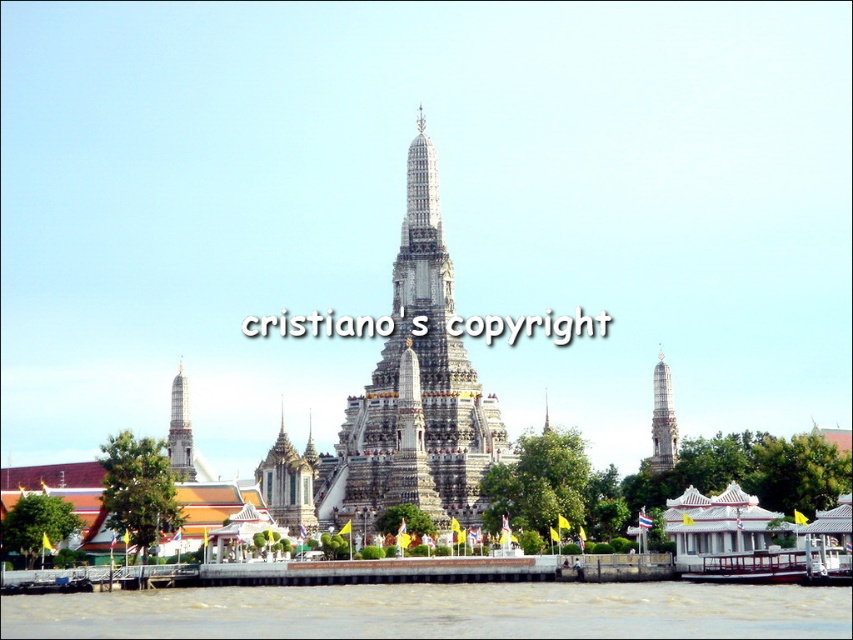
Between white stone temple at center and white stone tower at right, which one appears on the left side from the viewer's perspective?

white stone temple at center

Between point (430, 380) and point (662, 380), which one is positioned in front?

Point (430, 380) is in front.

You are a GUI agent. You are given a task and a screenshot of the screen. Output one action in this format:
    pyautogui.click(x=<x>, y=<y>)
    Task: Click on the white stone temple at center
    This screenshot has width=853, height=640.
    Given the screenshot: What is the action you would take?
    pyautogui.click(x=415, y=388)

Does white stone tower at right come behind white marble tower at left?

That is True.

Where is `white stone tower at right`? The image size is (853, 640). white stone tower at right is located at coordinates (662, 419).

Is silver metallic spire at lower left positioned at the back of white stone tower at right?

No, it is in front of white stone tower at right.

Is silver metallic spire at lower left in front of white stone tower at right?

That is True.

Is point (288, 492) farther from viewer compared to point (657, 412)?

No, it is in front of (657, 412).

You are a GUI agent. You are given a task and a screenshot of the screen. Output one action in this format:
    pyautogui.click(x=<x>, y=<y>)
    Task: Click on the silver metallic spire at lower left
    The height and width of the screenshot is (640, 853).
    Given the screenshot: What is the action you would take?
    pyautogui.click(x=288, y=483)